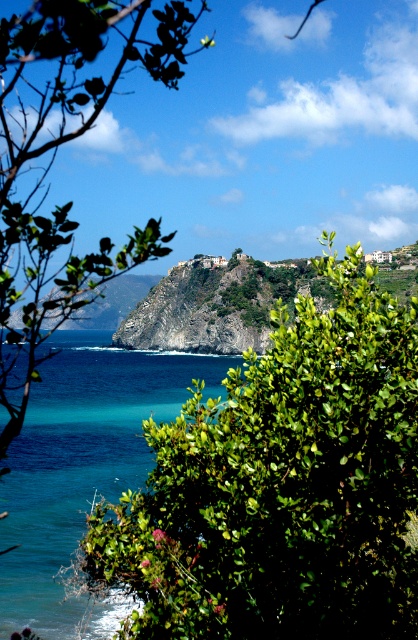
You are a hiker standing at the edge of the cliff and want to take a photo of the green leafy bush at center and the green rocky cliff at center. Which object is taller when viewed from your current position?

The green leafy bush at center is taller than the green rocky cliff at center, so it will appear taller in the photo.

You are standing at the point marked as point (155, 320) and want to move towards the point marked as point (58, 385). Given that the terrain between them is rugged and rocky, would you say the path is uphill or downhill?

The path from point (155, 320) to point (58, 385) is downhill because point (58, 385) is closer to the viewer, implying it is at a lower elevation than point (155, 320).